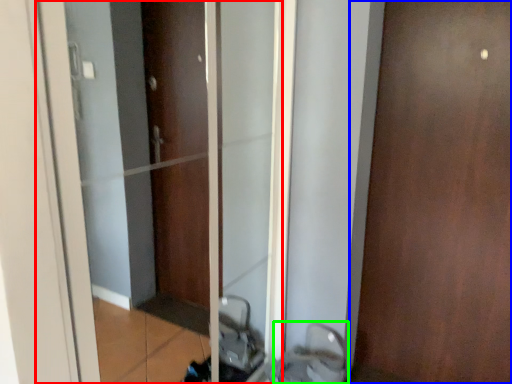
Question: Estimate the real-world distances between objects in this image. Which object is closer to elevator (highlighted by a red box), door (highlighted by a blue box) or sink (highlighted by a green box)?

Choices:
 (A) door
 (B) sink

Answer: (B)